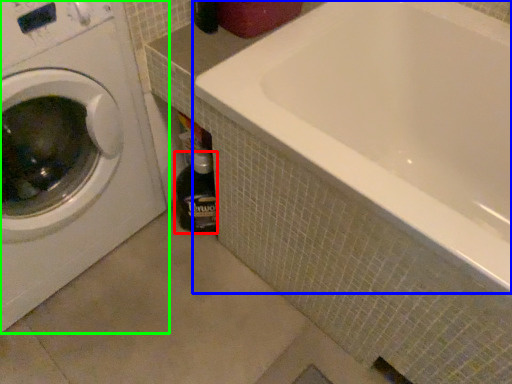
Question: Which is nearer to the bottle (highlighted by a red box)? bathtub (highlighted by a blue box) or washing machine (highlighted by a green box).

Choices:
 (A) bathtub
 (B) washing machine

Answer: (B)